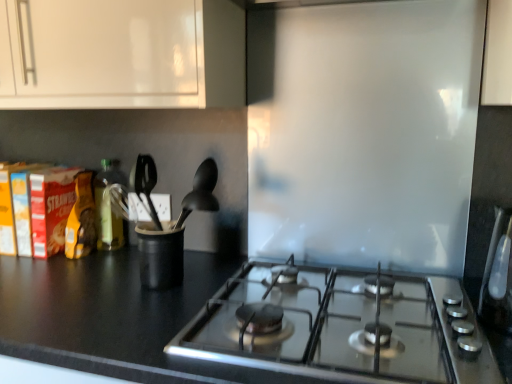
Question: From a real-world perspective, is black matte countertop at lower left above or below white glossy cabinet at upper left?

Choices:
 (A) above
 (B) below

Answer: (B)

Question: Is black matte countertop at lower left to the left or to the right of white glossy cabinet at upper left in the image?

Choices:
 (A) left
 (B) right

Answer: (B)

Question: Estimate the real-world distances between objects in this image. Which object is closer to the white glossy cabinet at upper left?

Choices:
 (A) black matte spoon at center
 (B) black matte countertop at lower left
 (C) satin silver toaster at right
 (D) black plastic utensil holder at center
 (E) green glass bottle at left

Answer: (A)

Question: Which is nearer to the white glossy cabinet at upper left?

Choices:
 (A) green glass bottle at left
 (B) black matte countertop at lower left
 (C) satin silver toaster at right
 (D) black matte spoon at center
 (E) black plastic utensil holder at center

Answer: (D)